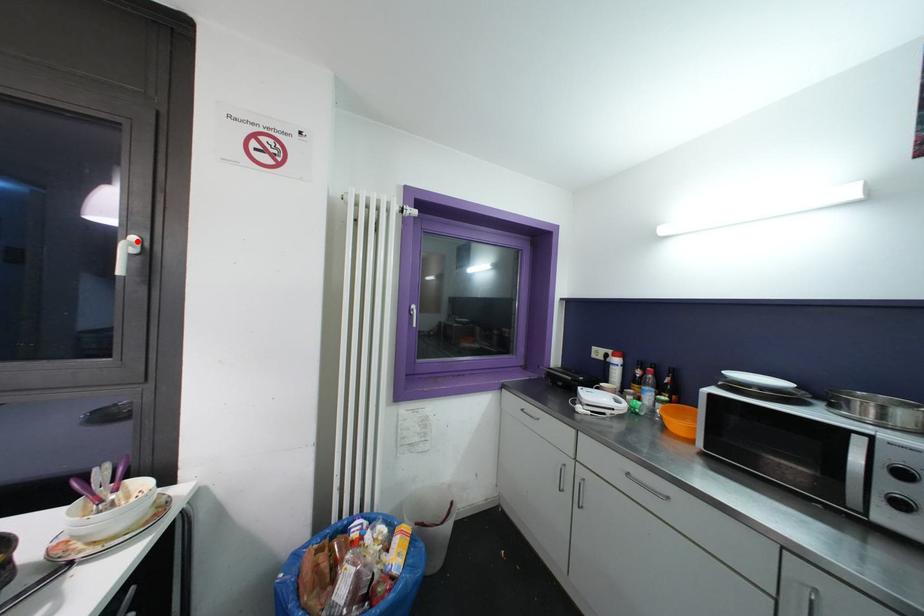
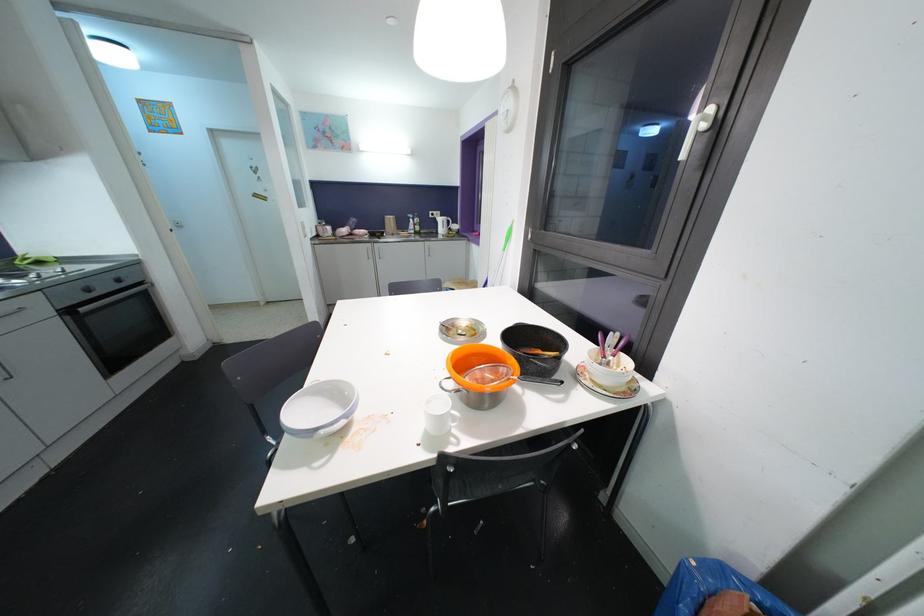
Where in the second image is the point corresponding to the highlighted location from the first image?

(713, 111)